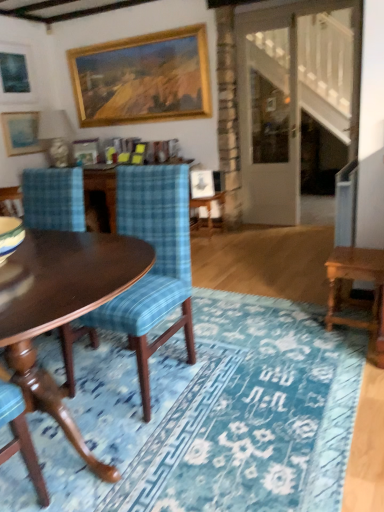
The image size is (384, 512). I want to click on empty space that is ontop of gold-framed painting at upper center, which ranks as the 1th picture frame in right-to-left order (from a real-world perspective), so click(x=141, y=36).